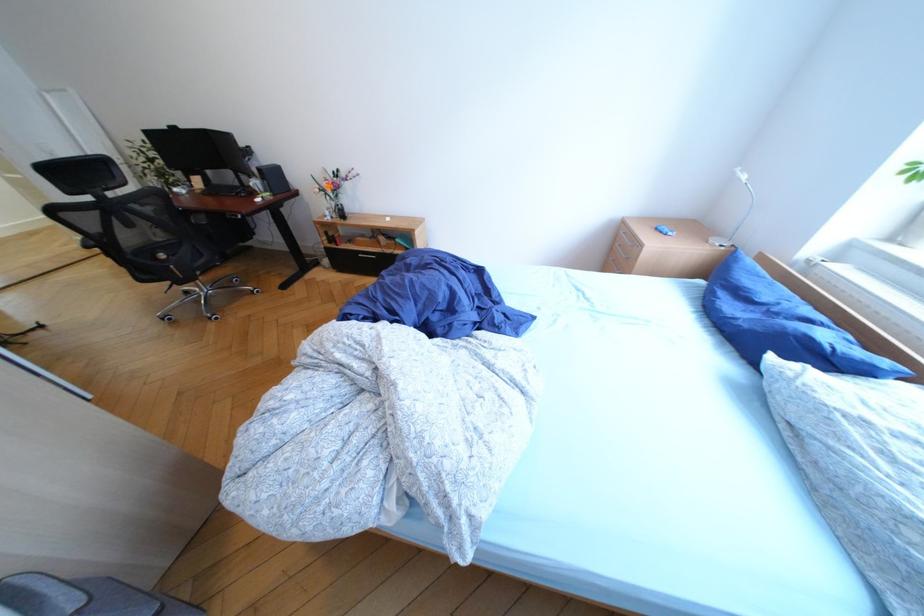
Find the location of a particular element. The height and width of the screenshot is (616, 924). blue pillow is located at coordinates (783, 323).